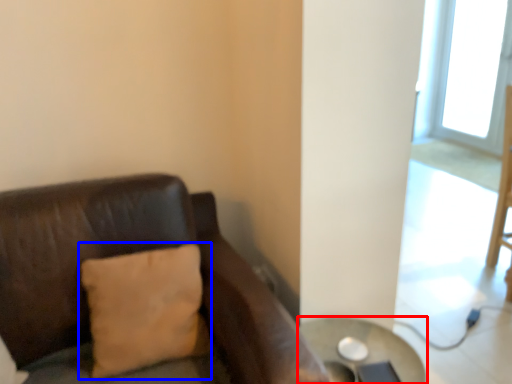
Question: Which object appears farthest to the camera in this image, table (highlighted by a red box) or pillow (highlighted by a blue box)?

Choices:
 (A) table
 (B) pillow

Answer: (A)